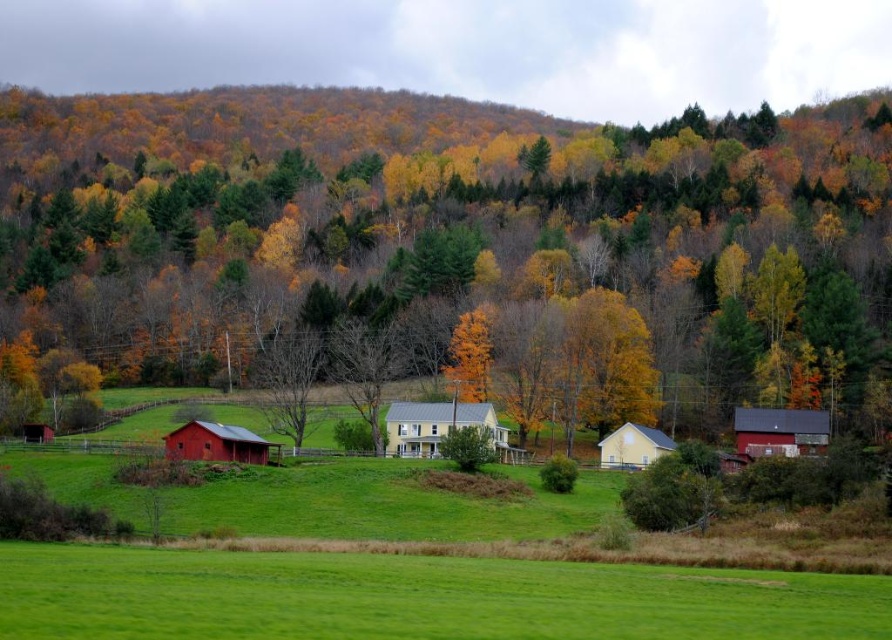
In the scene shown: Who is positioned more to the left, yellow matte house at center or matte yellow barn at center?

yellow matte house at center is more to the left.

Is yellow matte house at center wider than matte yellow barn at center?

Correct, the width of yellow matte house at center exceeds that of matte yellow barn at center.

Is point (398, 456) behind point (630, 433)?

No, (398, 456) is in front of (630, 433).

The image size is (892, 640). Identify the location of yellow matte house at center. (436, 426).

Who is higher up, matte red barn at lower left or golden yellow leaves at center?

golden yellow leaves at center

Does matte red barn at lower left lie in front of golden yellow leaves at center?

Yes, matte red barn at lower left is in front of golden yellow leaves at center.

Image resolution: width=892 pixels, height=640 pixels. In order to click on matte red barn at lower left in this screenshot , I will do `click(215, 444)`.

Can you confirm if matte yellow tree at center is positioned below yellow matte house at center?

No, matte yellow tree at center is not below yellow matte house at center.

Which is more to the right, matte yellow tree at center or yellow matte house at center?

yellow matte house at center

The image size is (892, 640). Identify the location of matte yellow tree at center. (460, 244).

Locate an element on the screen. matte yellow tree at center is located at coordinates (460, 244).